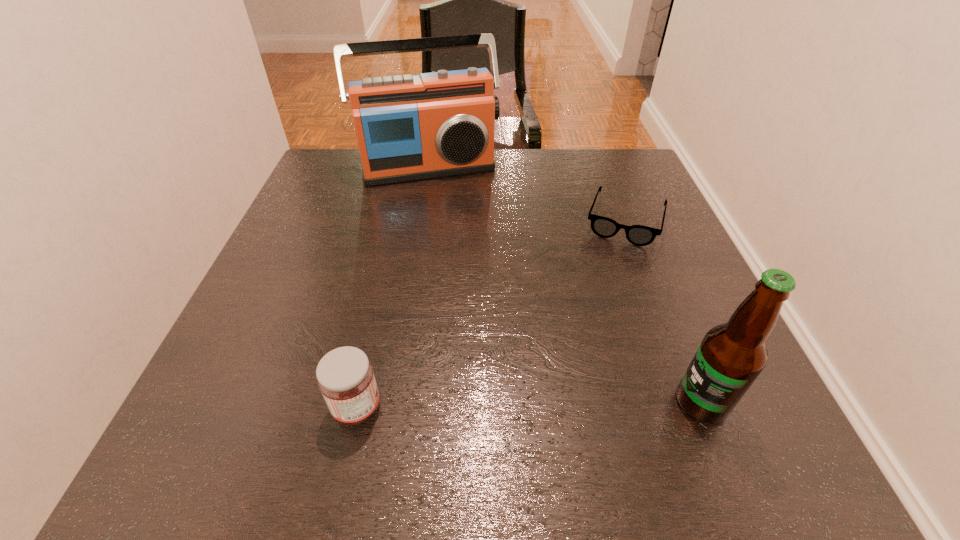
Locate an element on the screen. vacant point located 0.100m on the front-facing side of the farthest object is located at coordinates (449, 208).

The width and height of the screenshot is (960, 540). Identify the location of free point located on the front-facing side of the farthest object. (467, 260).

Locate an element on the screen. The image size is (960, 540). free space located on the arms of the second farthest object is located at coordinates (594, 332).

Find the location of a particular element. This screenshot has width=960, height=540. vacant space located on the arms of the second farthest object is located at coordinates (612, 271).

At what (x,y) coordinates should I click in order to perform the action: click on blank space located on the arms of the second farthest object. Please return your answer as a coordinate pair (x, y). Image resolution: width=960 pixels, height=540 pixels. Looking at the image, I should click on (596, 325).

Identify the location of object that is at the far edge. (438, 124).

This screenshot has width=960, height=540. I want to click on jam located at the near edge, so click(x=345, y=376).

You are a GUI agent. You are given a task and a screenshot of the screen. Output one action in this format:
    pyautogui.click(x=<x>, y=<y>)
    Task: Click on the beer bottle positioned at the near edge
    
    Given the screenshot: What is the action you would take?
    pyautogui.click(x=731, y=356)

Identify the location of object at the left edge. (438, 124).

Identify the location of beer bottle located at the right edge. The width and height of the screenshot is (960, 540). (731, 356).